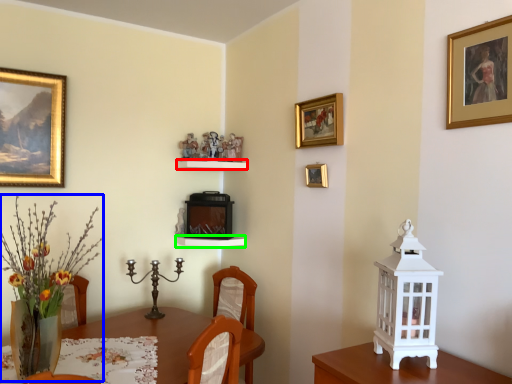
Question: Estimate the real-world distances between objects in this image. Which object is farther from shelf (highlighted by a red box), floral arrangement (highlighted by a blue box) or shelf (highlighted by a green box)?

Choices:
 (A) floral arrangement
 (B) shelf

Answer: (A)